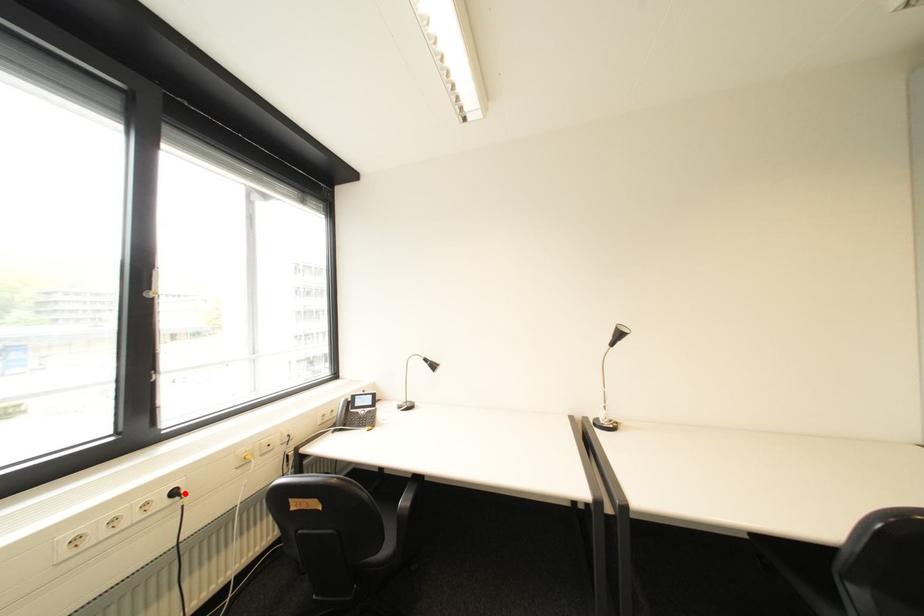
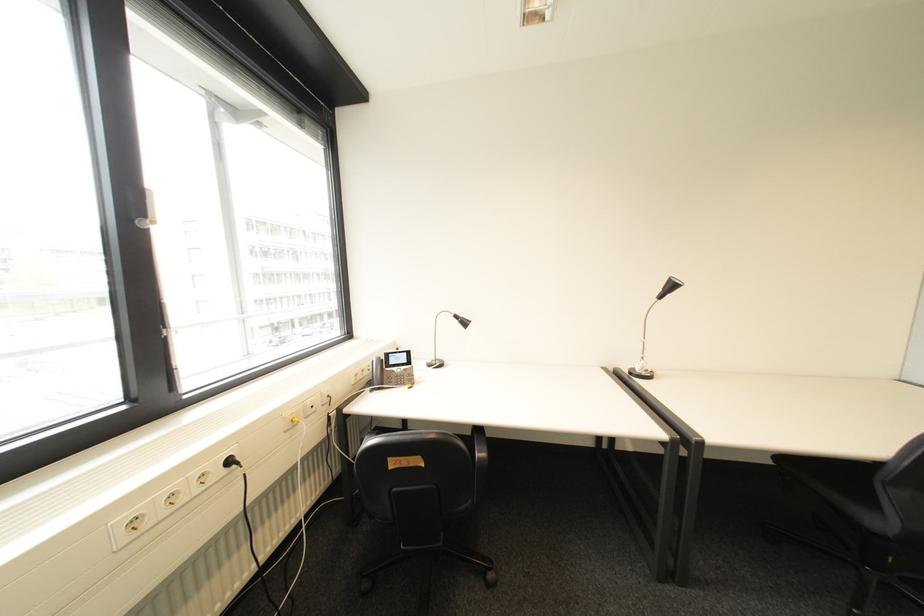
Locate, in the second image, the point that corresponds to the highlighted location in the first image.

(239, 463)